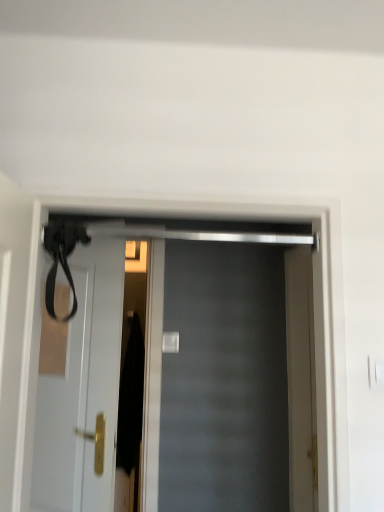
Question: Which direction should I rotate to face matte black door at center, which is counted as the first door, starting from the right, — up or down?

Choices:
 (A) down
 (B) up

Answer: (A)

Question: Is white glossy door at upper left, which is the second door in right-to-left order, facing towards matte black door at center, which is counted as the first door, starting from the right?

Choices:
 (A) yes
 (B) no

Answer: (B)

Question: Does white glossy door at upper left, which appears as the 2th door when viewed from the front, appear on the right side of matte black door at center, the 2th door from the left?

Choices:
 (A) no
 (B) yes

Answer: (A)

Question: Is white glossy door at upper left, which is the first door in back-to-front order, oriented away from matte black door at center, which is counted as the first door, starting from the right?

Choices:
 (A) yes
 (B) no

Answer: (B)

Question: Considering the relative sizes of white glossy door at upper left, the first door from the left, and matte black door at center, placed as the 2th door when sorted from back to front, in the image provided, is white glossy door at upper left, the first door from the left, wider than matte black door at center, placed as the 2th door when sorted from back to front,?

Choices:
 (A) no
 (B) yes

Answer: (A)

Question: Considering the relative positions of white glossy door at upper left, the first door from the left, and matte black door at center, which is counted as the first door, starting from the right, in the image provided, is white glossy door at upper left, the first door from the left, to the left of matte black door at center, which is counted as the first door, starting from the right, from the viewer's perspective?

Choices:
 (A) yes
 (B) no

Answer: (A)

Question: Is white glossy door at upper left, which is the first door in back-to-front order, positioned before matte black door at center, which is counted as the first door, starting from the right?

Choices:
 (A) no
 (B) yes

Answer: (A)

Question: Is matte black door at center, placed as the 2th door when sorted from back to front, positioned with its back to white glossy door at upper left, which is the second door in right-to-left order?

Choices:
 (A) no
 (B) yes

Answer: (B)

Question: Considering the relative positions of matte black door at center, placed as the 2th door when sorted from back to front, and white glossy door at upper left, which is the first door in back-to-front order, in the image provided, is matte black door at center, placed as the 2th door when sorted from back to front, in front of white glossy door at upper left, which is the first door in back-to-front order,?

Choices:
 (A) yes
 (B) no

Answer: (A)

Question: Could you tell me if matte black door at center, which is counted as the first door, starting from the right, is turned towards white glossy door at upper left, which appears as the 2th door when viewed from the front?

Choices:
 (A) no
 (B) yes

Answer: (A)

Question: Is matte black door at center, the 2th door from the left, thinner than white glossy door at upper left, which is the second door in right-to-left order?

Choices:
 (A) yes
 (B) no

Answer: (B)

Question: Is matte black door at center, which is counted as the first door, starting from the right, touching white glossy door at upper left, which is the first door in back-to-front order?

Choices:
 (A) yes
 (B) no

Answer: (B)

Question: Does matte black door at center, positioned as the 1th door in front-to-back order, have a greater height compared to white glossy door at upper left, the first door from the left?

Choices:
 (A) yes
 (B) no

Answer: (B)

Question: Considering the relative positions of white glossy door at upper left, the first door from the left, and matte black door at center, the 2th door from the left, in the image provided, is white glossy door at upper left, the first door from the left, to the left or to the right of matte black door at center, the 2th door from the left,?

Choices:
 (A) left
 (B) right

Answer: (A)